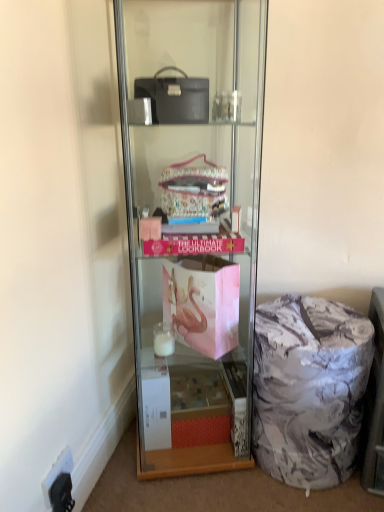
Question: Is black plastic electric outlet at lower left at the right side of marble-patterned fabric bag at lower right?

Choices:
 (A) yes
 (B) no

Answer: (B)

Question: From a real-world perspective, does black plastic electric outlet at lower left stand above marble-patterned fabric bag at lower right?

Choices:
 (A) yes
 (B) no

Answer: (B)

Question: Is black plastic electric outlet at lower left touching marble-patterned fabric bag at lower right?

Choices:
 (A) no
 (B) yes

Answer: (A)

Question: Is marble-patterned fabric bag at lower right at the back of black plastic electric outlet at lower left?

Choices:
 (A) no
 (B) yes

Answer: (A)

Question: Is black plastic electric outlet at lower left not within marble-patterned fabric bag at lower right?

Choices:
 (A) yes
 (B) no

Answer: (A)

Question: Is marble-patterned fabric bag at lower right to the left or to the right of black plastic electric outlet at lower left in the image?

Choices:
 (A) right
 (B) left

Answer: (A)

Question: In terms of width, does marble-patterned fabric bag at lower right look wider or thinner when compared to black plastic electric outlet at lower left?

Choices:
 (A) wide
 (B) thin

Answer: (A)

Question: From their relative heights in the image, would you say marble-patterned fabric bag at lower right is taller or shorter than black plastic electric outlet at lower left?

Choices:
 (A) tall
 (B) short

Answer: (A)

Question: In the image, is marble-patterned fabric bag at lower right positioned in front of or behind black plastic electric outlet at lower left?

Choices:
 (A) front
 (B) behind

Answer: (B)

Question: From their relative heights in the image, would you say clear glass shelf at center is taller or shorter than marble-patterned fabric bag at lower right?

Choices:
 (A) tall
 (B) short

Answer: (A)

Question: Considering the positions of clear glass shelf at center and marble-patterned fabric bag at lower right in the image, is clear glass shelf at center wider or thinner than marble-patterned fabric bag at lower right?

Choices:
 (A) thin
 (B) wide

Answer: (B)

Question: Based on their positions, is clear glass shelf at center located to the left or right of marble-patterned fabric bag at lower right?

Choices:
 (A) left
 (B) right

Answer: (A)

Question: Relative to marble-patterned fabric bag at lower right, is clear glass shelf at center in front or behind?

Choices:
 (A) front
 (B) behind

Answer: (A)

Question: From the image's perspective, is marble-patterned ottoman at lower right located above or below black plastic electric outlet at lower left?

Choices:
 (A) below
 (B) above

Answer: (B)

Question: Is marble-patterned ottoman at lower right bigger or smaller than black plastic electric outlet at lower left?

Choices:
 (A) small
 (B) big

Answer: (B)